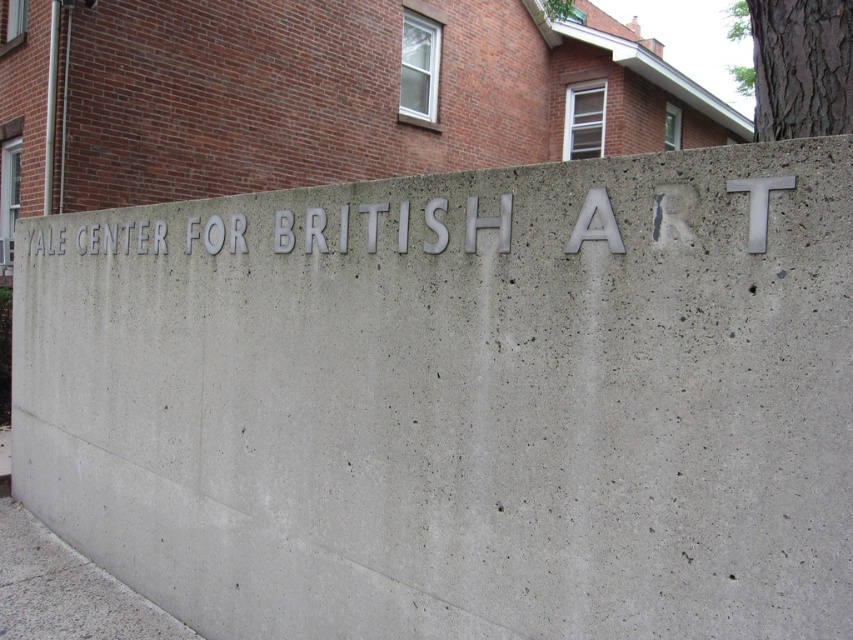
Can you confirm if silver metallic letters at center is thinner than brown textured bark at upper right?

Yes.

Between silver metallic letters at center and brown textured bark at upper right, which one is positioned higher?

brown textured bark at upper right is above.

Is point (136, 250) behind point (758, 56)?

That is True.

This screenshot has width=853, height=640. I want to click on silver metallic letters at center, so click(x=102, y=237).